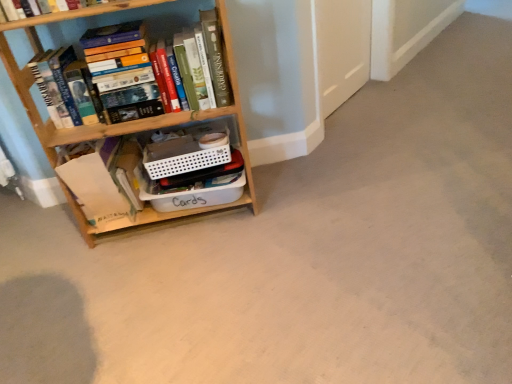
Locate an element on the screen. white plastic container at center is located at coordinates (119, 174).

The height and width of the screenshot is (384, 512). I want to click on wooden bookcase at left, so click(x=128, y=122).

How much space does hardcover books at left, placed as the 2th book when sorted from bottom to top, occupy vertically?

The height of hardcover books at left, placed as the 2th book when sorted from bottom to top, is 11.80 inches.

The height and width of the screenshot is (384, 512). I want to click on white plastic container at center, so click(119, 174).

From the picture: Can you tell me how much white paper bag at lower left, the second book when ordered from top to bottom, and hardcover books at left, placed as the 2th book when sorted from bottom to top, differ in facing direction?

There is a 0.000294-degree angle between the facing directions of white paper bag at lower left, the second book when ordered from top to bottom, and hardcover books at left, placed as the 2th book when sorted from bottom to top.

From the image's perspective, is white paper bag at lower left, the second book when ordered from top to bottom, located beneath hardcover books at left, placed as the 2th book when sorted from bottom to top?

Correct, white paper bag at lower left, the second book when ordered from top to bottom, appears lower than hardcover books at left, placed as the 2th book when sorted from bottom to top, in the image.

Who is smaller, white paper bag at lower left, the second book when ordered from top to bottom, or hardcover books at left, placed as the 2th book when sorted from bottom to top?

With smaller size is white paper bag at lower left, the second book when ordered from top to bottom.

Which object is wider, white paper bag at lower left, the second book when ordered from top to bottom, or hardcover books at left, placed as the 2th book when sorted from bottom to top?

white paper bag at lower left, the second book when ordered from top to bottom, is wider.

Is hardcover books at left, placed as the 2th book when sorted from bottom to top, bigger or smaller than white paper bag at lower left, the second book when ordered from top to bottom?

Considering their sizes, hardcover books at left, placed as the 2th book when sorted from bottom to top, takes up more space than white paper bag at lower left, the second book when ordered from top to bottom.

From the image's perspective, does hardcover books at left, placed as the 2th book when sorted from bottom to top, appear higher than white paper bag at lower left, the second book when ordered from top to bottom?

Yes.

Looking at this image, is hardcover books at left, which appears as the 1th book when viewed from the top, outside of white paper bag at lower left, the 1th book in the bottom-to-top sequence?

Yes, hardcover books at left, which appears as the 1th book when viewed from the top, is outside of white paper bag at lower left, the 1th book in the bottom-to-top sequence.

Which is more to the left, wooden bookcase at left or white paper bag at lower left, the 1th book in the bottom-to-top sequence?

From the viewer's perspective, white paper bag at lower left, the 1th book in the bottom-to-top sequence, appears more on the left side.

Considering the positions of points (140, 129) and (102, 154), is point (140, 129) farther from camera compared to point (102, 154)?

No.

Relative to white paper bag at lower left, the 1th book in the bottom-to-top sequence, is wooden bookcase at left in front or behind?

wooden bookcase at left is positioned closer to the viewer than white paper bag at lower left, the 1th book in the bottom-to-top sequence.

From a real-world perspective, is wooden bookcase at left on top of white paper bag at lower left, the second book when ordered from top to bottom?

Yes, from a real-world perspective, wooden bookcase at left is over white paper bag at lower left, the second book when ordered from top to bottom

Does point (86, 153) lie in front of point (34, 124)?

No, it is not.

Is white plastic container at center next to wooden bookcase at left and touching it?

No, white plastic container at center is not in contact with wooden bookcase at left.

Would you say wooden bookcase at left is part of white plastic container at center's contents?

No, wooden bookcase at left is not inside white plastic container at center.

Consider the image. From the image's perspective, who appears lower, white plastic container at center or wooden bookcase at left?

white plastic container at center appears lower in the image.

Consider the image. Is hardcover books at left, which appears as the 1th book when viewed from the top, next to white plastic container at center and touching it?

hardcover books at left, which appears as the 1th book when viewed from the top, is not next to white plastic container at center, and they're not touching.

Which object is further away from the camera taking this photo, hardcover books at left, placed as the 2th book when sorted from bottom to top, or white plastic container at center?

white plastic container at center is more distant.

Is hardcover books at left, which appears as the 1th book when viewed from the top, completely or partially outside of white plastic container at center?

Yes, hardcover books at left, which appears as the 1th book when viewed from the top, is located beyond the bounds of white plastic container at center.

Between hardcover books at left, which appears as the 1th book when viewed from the top, and white plastic container at center, which one has smaller width?

Thinner between the two is hardcover books at left, which appears as the 1th book when viewed from the top.

Does hardcover books at left, which appears as the 1th book when viewed from the top, have a smaller size compared to wooden bookcase at left?

Indeed, hardcover books at left, which appears as the 1th book when viewed from the top, has a smaller size compared to wooden bookcase at left.

Where is `bookcase on the left of hardcover books at left, which appears as the 1th book when viewed from the top`? The width and height of the screenshot is (512, 384). bookcase on the left of hardcover books at left, which appears as the 1th book when viewed from the top is located at coordinates (128, 122).

Is hardcover books at left, which appears as the 1th book when viewed from the top, to the left of wooden bookcase at left from the viewer's perspective?

Incorrect, hardcover books at left, which appears as the 1th book when viewed from the top, is not on the left side of wooden bookcase at left.

Is wooden bookcase at left inside hardcover books at left, placed as the 2th book when sorted from bottom to top?

Definitely not — wooden bookcase at left is not inside hardcover books at left, placed as the 2th book when sorted from bottom to top.

Is white plastic container at center next to white paper bag at lower left, the 1th book in the bottom-to-top sequence?

Absolutely, white plastic container at center is next to and touching white paper bag at lower left, the 1th book in the bottom-to-top sequence.

Can you tell me how much white plastic container at center and white paper bag at lower left, the 1th book in the bottom-to-top sequence, differ in facing direction?

There is a 1.42e-05-degree angle between the facing directions of white plastic container at center and white paper bag at lower left, the 1th book in the bottom-to-top sequence.

Considering the points (140, 202) and (75, 198), which point is in front, point (140, 202) or point (75, 198)?

The point (75, 198) is closer.

Image resolution: width=512 pixels, height=384 pixels. What are the coordinates of `book on the right of white paper bag at lower left, the second book when ordered from top to bottom` in the screenshot? It's located at (126, 21).

This screenshot has height=384, width=512. I want to click on book in front of the white paper bag at lower left, the second book when ordered from top to bottom, so click(x=126, y=21).

Looking at the image, which one is located closer to white plastic container at center, white paper bag at lower left, the second book when ordered from top to bottom, or wooden bookcase at left?

white paper bag at lower left, the second book when ordered from top to bottom, lies closer to white plastic container at center than the other object.

Looking at the image, which one is located further to white paper bag at lower left, the second book when ordered from top to bottom, white plastic container at center or hardcover books at left, placed as the 2th book when sorted from bottom to top?

hardcover books at left, placed as the 2th book when sorted from bottom to top, lies further to white paper bag at lower left, the second book when ordered from top to bottom, than the other object.

Considering their positions, is white paper bag at lower left, the 1th book in the bottom-to-top sequence, positioned further to hardcover books at left, which appears as the 1th book when viewed from the top, than white plastic container at center?

Among the two, white paper bag at lower left, the 1th book in the bottom-to-top sequence, is located further to hardcover books at left, which appears as the 1th book when viewed from the top.

Considering their positions, is wooden bookcase at left positioned closer to white paper bag at lower left, the 1th book in the bottom-to-top sequence, than white plastic container at center?

Among the two, white plastic container at center is located nearer to white paper bag at lower left, the 1th book in the bottom-to-top sequence.

When comparing their distances from white paper bag at lower left, the 1th book in the bottom-to-top sequence, does hardcover books at left, which appears as the 1th book when viewed from the top, or wooden bookcase at left seem closer?

wooden bookcase at left lies closer to white paper bag at lower left, the 1th book in the bottom-to-top sequence, than the other object.

Looking at this image, based on their spatial positions, is wooden bookcase at left or white paper bag at lower left, the second book when ordered from top to bottom, further from hardcover books at left, which appears as the 1th book when viewed from the top?

Based on the image, white paper bag at lower left, the second book when ordered from top to bottom, appears to be further to hardcover books at left, which appears as the 1th book when viewed from the top.

Which object lies nearer to the anchor point wooden bookcase at left, hardcover books at left, placed as the 2th book when sorted from bottom to top, or white plastic container at center?

Among the two, white plastic container at center is located nearer to wooden bookcase at left.

Considering their positions, is white paper bag at lower left, the second book when ordered from top to bottom, positioned closer to hardcover books at left, which appears as the 1th book when viewed from the top, than wooden bookcase at left?

Among the two, wooden bookcase at left is located nearer to hardcover books at left, which appears as the 1th book when viewed from the top.

Where is `cabinet between hardcover books at left, placed as the 2th book when sorted from bottom to top, and white paper bag at lower left, the second book when ordered from top to bottom, in the vertical direction`? cabinet between hardcover books at left, placed as the 2th book when sorted from bottom to top, and white paper bag at lower left, the second book when ordered from top to bottom, in the vertical direction is located at coordinates (119, 174).

This screenshot has height=384, width=512. Identify the location of bookcase between hardcover books at left, which appears as the 1th book when viewed from the top, and white paper bag at lower left, the 1th book in the bottom-to-top sequence, in the vertical direction. (128, 122).